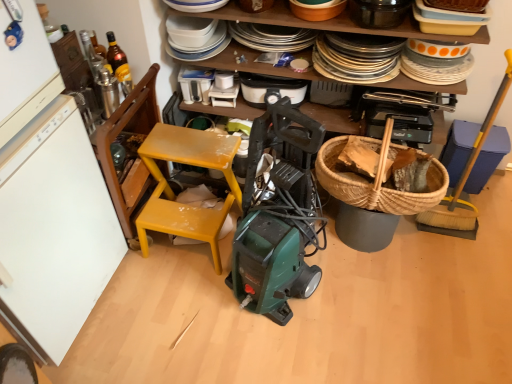
At what (x,y) coordinates should I click in order to perform the action: click on unoccupied area in front of blue plastic trash can at right, which is counted as the first appliance, starting from the right. Please return your answer as a coordinate pair (x, y). Looking at the image, I should click on [x=490, y=222].